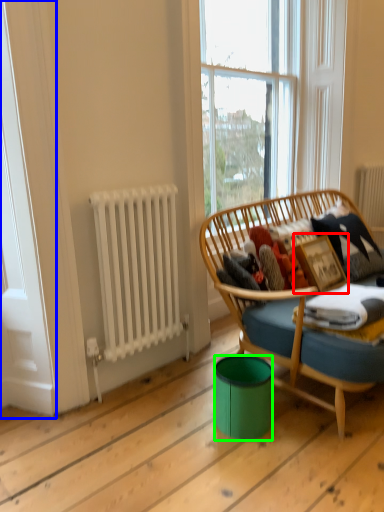
Question: Which object is the closest to the picture frame (highlighted by a red box)? Choose among these: screen door (highlighted by a blue box) or trash bin/can (highlighted by a green box).

Choices:
 (A) screen door
 (B) trash bin/can

Answer: (B)